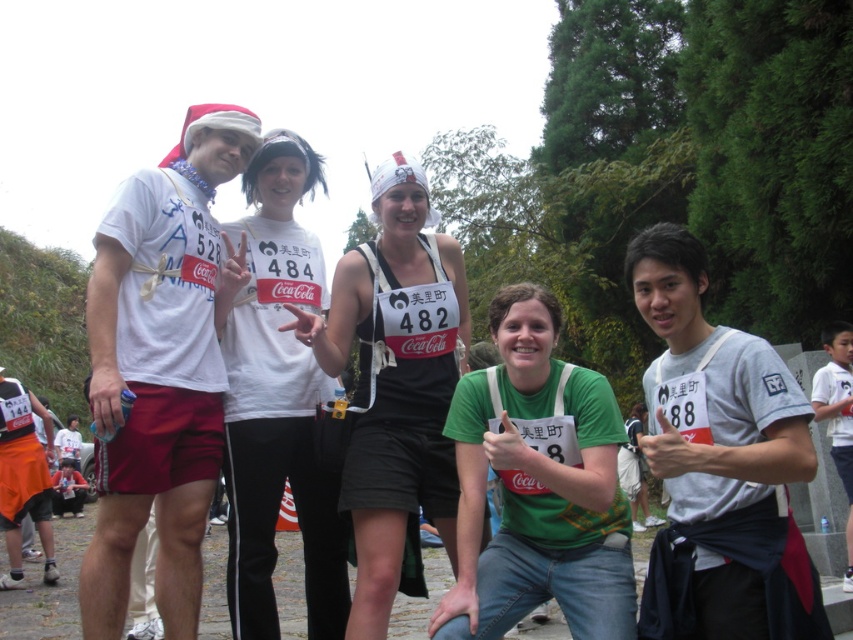
Question: Does white t-shirt at center appear on the right side of green matte shirt at center?

Choices:
 (A) no
 (B) yes

Answer: (A)

Question: Which of the following is the closest to the observer?

Choices:
 (A) white matte t-shirt at center
 (B) green matte shirt at center
 (C) black fabric tank top at center

Answer: (B)

Question: Is green matte shirt at center to the left of black fabric tank top at center from the viewer's perspective?

Choices:
 (A) yes
 (B) no

Answer: (B)

Question: Which object appears closest to the camera in this image?

Choices:
 (A) white matte t-shirt at center
 (B) gray fabric shirt at center
 (C) white t-shirt at center
 (D) green matte shirt at center

Answer: (B)

Question: Is gray fabric shirt at center closer to the viewer compared to black fabric tank top at center?

Choices:
 (A) no
 (B) yes

Answer: (B)

Question: Which of the following is the closest to the observer?

Choices:
 (A) gray fabric shirt at center
 (B) white t-shirt at center
 (C) green matte shirt at center
 (D) black fabric tank top at center

Answer: (A)